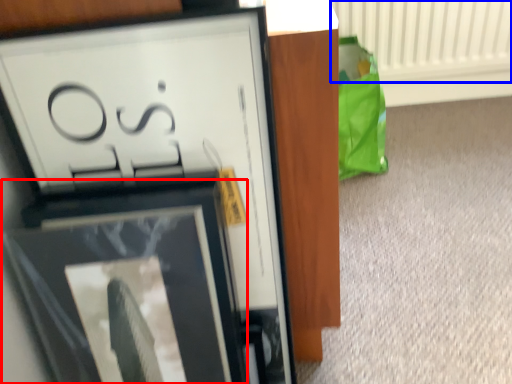
Question: Among these objects, which one is nearest to the camera, picture frame (highlighted by a red box) or radiator (highlighted by a blue box)?

Choices:
 (A) picture frame
 (B) radiator

Answer: (A)